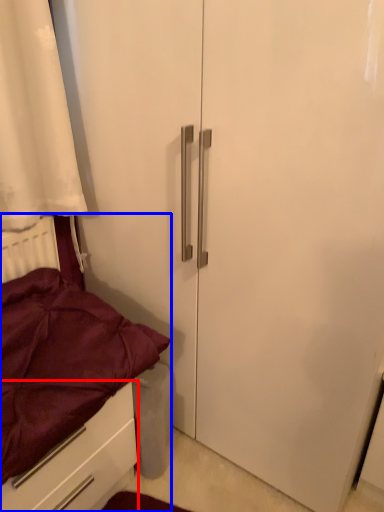
Question: Which point is closer to the camera, drawer (highlighted by a red box) or bed (highlighted by a blue box)?

Choices:
 (A) drawer
 (B) bed

Answer: (B)